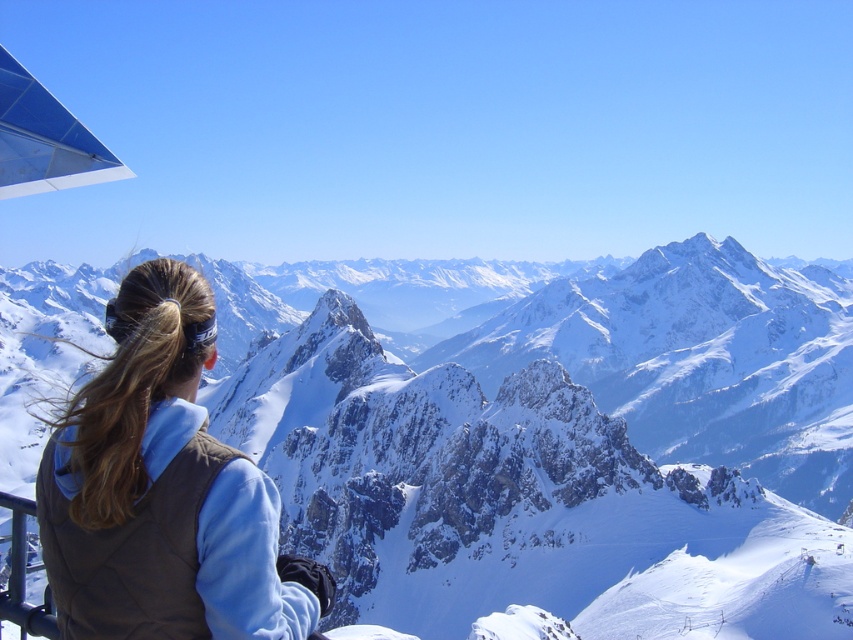
Question: Is white snow-covered mountain range at upper center positioned before brown fleece vest at center?

Choices:
 (A) yes
 (B) no

Answer: (B)

Question: Which object is closer to the camera taking this photo?

Choices:
 (A) brown fleece vest at center
 (B) white snow-covered mountain range at upper center

Answer: (A)

Question: Does white snow-covered mountain range at upper center appear under brown fleece vest at center?

Choices:
 (A) yes
 (B) no

Answer: (B)

Question: Can you confirm if white snow-covered mountain range at upper center is bigger than brown fleece vest at center?

Choices:
 (A) no
 (B) yes

Answer: (B)

Question: Among these points, which one is nearest to the camera?

Choices:
 (A) (131, 544)
 (B) (306, 369)

Answer: (A)